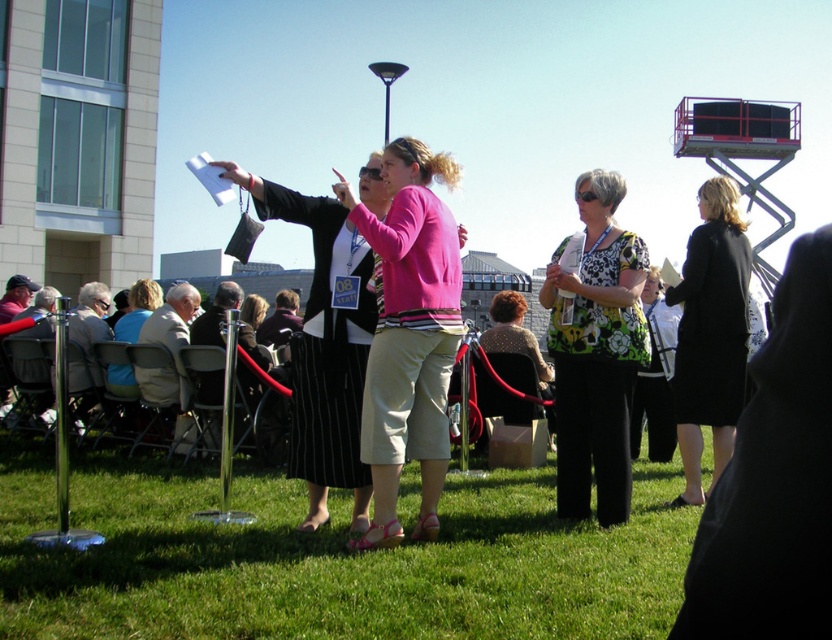
Measure the distance between point (598,572) and camera.

They are 16.10 feet apart.

How distant is green grass at center from black coat at center?

green grass at center and black coat at center are 1.71 meters apart from each other.

Where is `green grass at center`? This screenshot has height=640, width=832. green grass at center is located at coordinates (329, 557).

Which of these two, pink fabric shirt at center or light brown wooden chairs at lower left, stands shorter?

light brown wooden chairs at lower left is shorter.

Is pink fabric shirt at center thinner than light brown wooden chairs at lower left?

No, pink fabric shirt at center is not thinner than light brown wooden chairs at lower left.

Is point (364, 412) less distant than point (157, 298)?

Yes, point (364, 412) is closer to viewer.

Where is `pink fabric shirt at center`? This screenshot has height=640, width=832. pink fabric shirt at center is located at coordinates (409, 333).

Which is below, green grass at center or floral print blouse at center?

Positioned lower is green grass at center.

Does green grass at center have a greater height compared to floral print blouse at center?

No.

Between point (652, 608) and point (592, 337), which one is positioned behind?

The point (592, 337) is behind.

Identify the location of green grass at center. (329, 557).